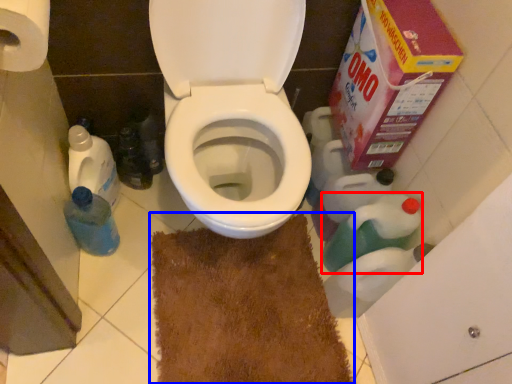
Question: Which of the following is the closest to the observer, cleaning product (highlighted by a red box) or doormat (highlighted by a blue box)?

Choices:
 (A) cleaning product
 (B) doormat

Answer: (B)